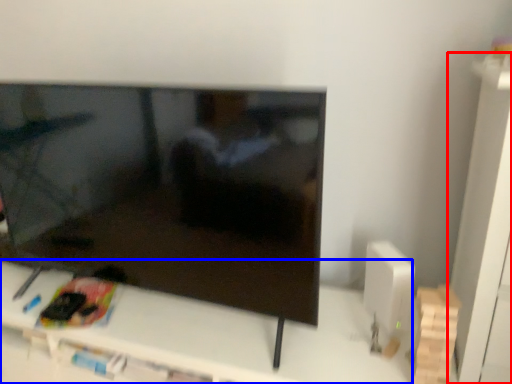
Question: Which point is closer to the camera, tv cabinet (highlighted by a red box) or furniture (highlighted by a blue box)?

Choices:
 (A) tv cabinet
 (B) furniture

Answer: (A)